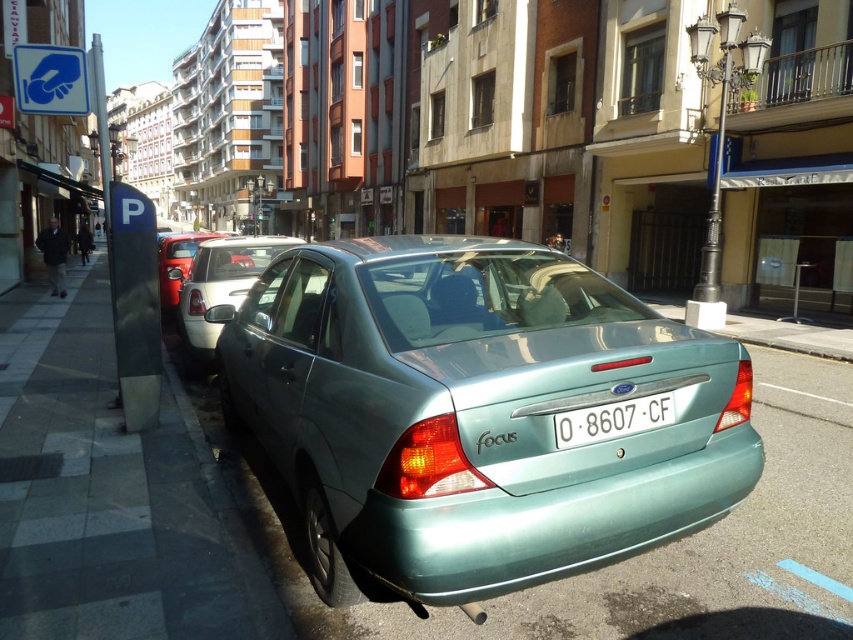
Is dark gray metallic parking meter at left behind white plastic license plate at center?

Yes, dark gray metallic parking meter at left is further from the viewer.

Does dark gray metallic parking meter at left have a smaller size compared to white plastic license plate at center?

No.

Does point (109, 264) come behind point (585, 426)?

Yes, point (109, 264) is behind point (585, 426).

The height and width of the screenshot is (640, 853). I want to click on dark gray metallic parking meter at left, so click(134, 305).

Between metallic silver sedan at center and white plastic license plate at center, which one is positioned lower?

white plastic license plate at center

Can you confirm if metallic silver sedan at center is taller than white plastic license plate at center?

Yes.

Which is behind, point (219, 328) or point (619, 412)?

Point (219, 328)

You are a GUI agent. You are given a task and a screenshot of the screen. Output one action in this format:
    pyautogui.click(x=<x>, y=<y>)
    Task: Click on the metallic silver sedan at center
    The image size is (853, 640).
    Given the screenshot: What is the action you would take?
    pyautogui.click(x=221, y=284)

In order to click on gray concrete sidewalk at lower left in this screenshot , I will do `click(109, 493)`.

Can you confirm if gray concrete sidewalk at lower left is positioned below metallic silver sedan at center?

Yes.

Identify the location of gray concrete sidewalk at lower left. (109, 493).

The image size is (853, 640). Identify the location of gray concrete sidewalk at lower left. (109, 493).